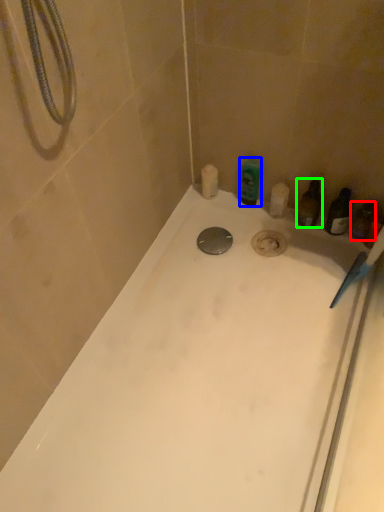
Question: Which object is the farthest from toiletry (highlighted by a red box)? Choose among these: toiletry (highlighted by a blue box) or toiletry (highlighted by a green box).

Choices:
 (A) toiletry
 (B) toiletry

Answer: (A)